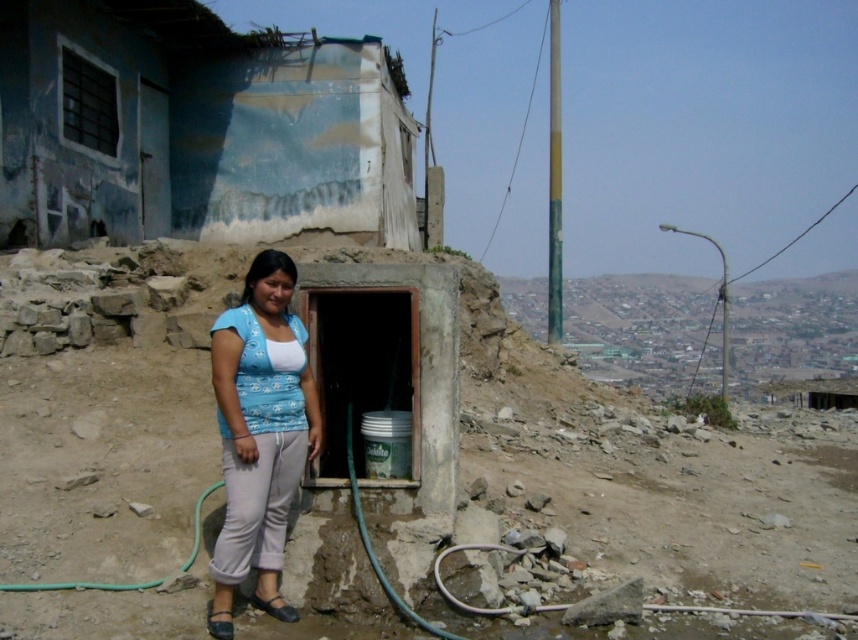
Question: Is blue painted wall at upper left to the right of blue cotton shirt at center from the viewer's perspective?

Choices:
 (A) yes
 (B) no

Answer: (B)

Question: Which point is farther to the camera?

Choices:
 (A) blue cotton shirt at center
 (B) blue painted wall at upper left

Answer: (B)

Question: Is blue painted wall at upper left to the right of blue cotton shirt at center from the viewer's perspective?

Choices:
 (A) no
 (B) yes

Answer: (A)

Question: Is blue painted wall at upper left in front of blue cotton shirt at center?

Choices:
 (A) no
 (B) yes

Answer: (A)

Question: Which of the following is the closest to the observer?

Choices:
 (A) blue painted wall at upper left
 (B) blue cotton shirt at center

Answer: (B)